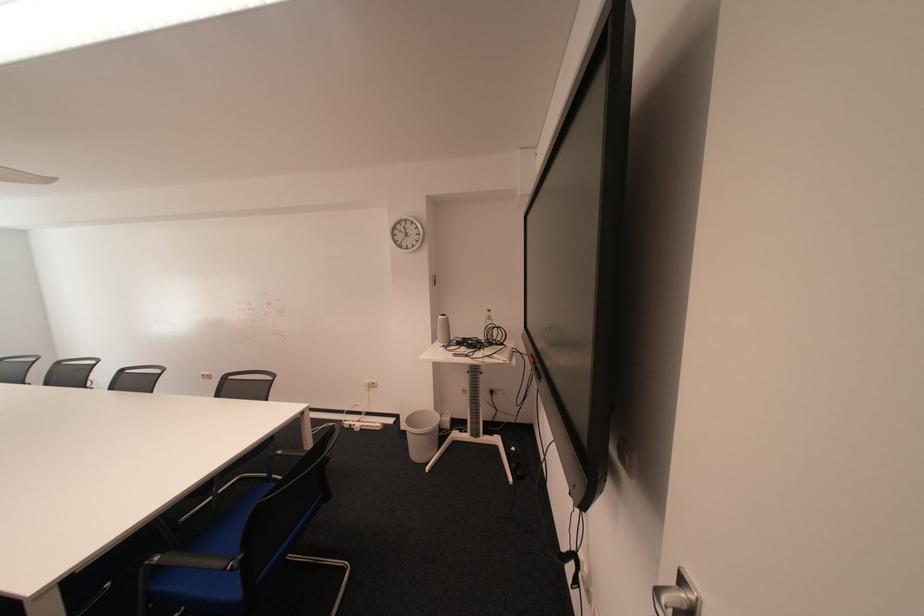
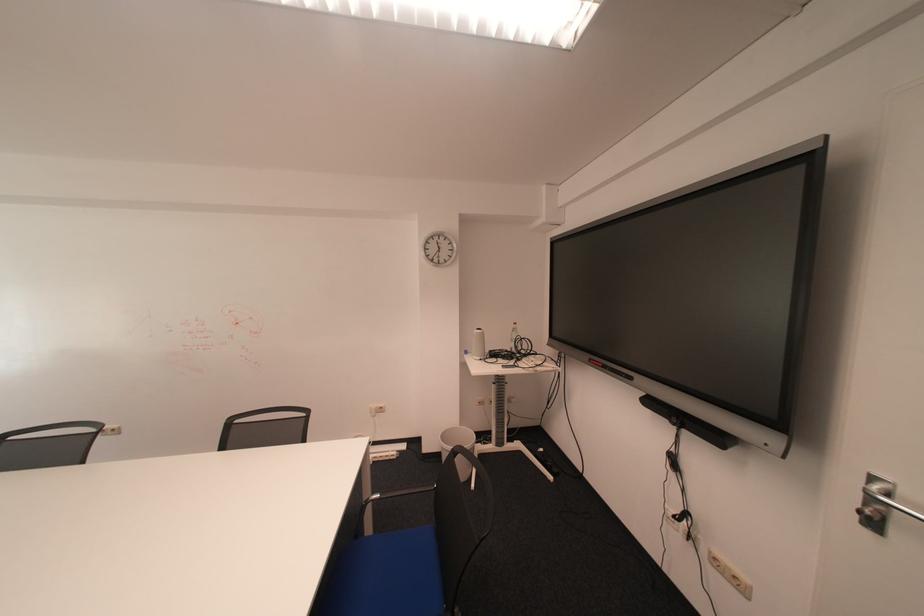
Find the pixel in the second image that matches (377,383) in the first image.

(382, 408)